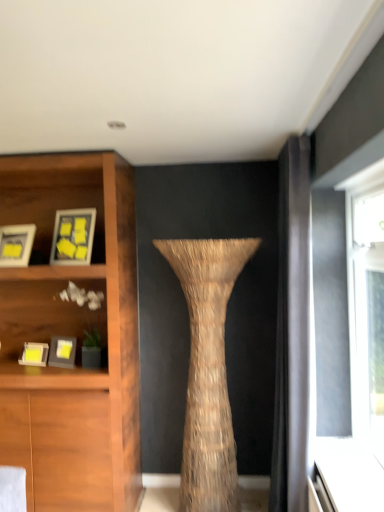
Question: Could you tell me if matte black picture frame at left, the 2th picture frame from the bottom, is turned towards braided straw vase at center?

Choices:
 (A) yes
 (B) no

Answer: (B)

Question: Does matte black picture frame at left, the 2th picture frame from the bottom, appear on the left side of braided straw vase at center?

Choices:
 (A) yes
 (B) no

Answer: (A)

Question: Is there a large distance between matte black picture frame at left, the 2th picture frame from the bottom, and braided straw vase at center?

Choices:
 (A) no
 (B) yes

Answer: (A)

Question: Can you confirm if matte black picture frame at left, the 3th picture frame viewed from the top, is taller than braided straw vase at center?

Choices:
 (A) no
 (B) yes

Answer: (A)

Question: Is braided straw vase at center completely or partially inside matte black picture frame at left, the 3th picture frame viewed from the top?

Choices:
 (A) yes
 (B) no

Answer: (B)

Question: From a real-world perspective, is matte gray picture frame at left, which is the first picture frame from bottom to top, physically located above or below braided straw vase at center?

Choices:
 (A) below
 (B) above

Answer: (B)

Question: Is matte gray picture frame at left, which is the first picture frame from bottom to top, to the left or to the right of braided straw vase at center in the image?

Choices:
 (A) left
 (B) right

Answer: (A)

Question: From the image's perspective, is matte gray picture frame at left, acting as the fourth picture frame starting from the top, positioned above or below braided straw vase at center?

Choices:
 (A) above
 (B) below

Answer: (A)

Question: Considering the positions of matte gray picture frame at left, acting as the fourth picture frame starting from the top, and braided straw vase at center in the image, is matte gray picture frame at left, acting as the fourth picture frame starting from the top, taller or shorter than braided straw vase at center?

Choices:
 (A) tall
 (B) short

Answer: (B)

Question: Is matte gray picture frame at left, acting as the fourth picture frame starting from the top, to the left or to the right of matte wooden picture frame at upper left, which is counted as the 1th picture frame, starting from the top, in the image?

Choices:
 (A) left
 (B) right

Answer: (A)

Question: Relative to matte wooden picture frame at upper left, which is counted as the 1th picture frame, starting from the top, is matte gray picture frame at left, which is the first picture frame from bottom to top, in front or behind?

Choices:
 (A) behind
 (B) front

Answer: (A)

Question: In terms of width, does matte gray picture frame at left, which is the first picture frame from bottom to top, look wider or thinner when compared to matte wooden picture frame at upper left, the fourth picture frame from the bottom?

Choices:
 (A) wide
 (B) thin

Answer: (A)

Question: Is matte gray picture frame at left, which is the first picture frame from bottom to top, taller or shorter than matte wooden picture frame at upper left, the fourth picture frame from the bottom?

Choices:
 (A) tall
 (B) short

Answer: (B)

Question: Is braided straw vase at center to the left or to the right of matte gray picture frame at left, which is the first picture frame from bottom to top, in the image?

Choices:
 (A) left
 (B) right

Answer: (B)

Question: Is braided straw vase at center inside or outside of matte gray picture frame at left, acting as the fourth picture frame starting from the top?

Choices:
 (A) outside
 (B) inside

Answer: (A)